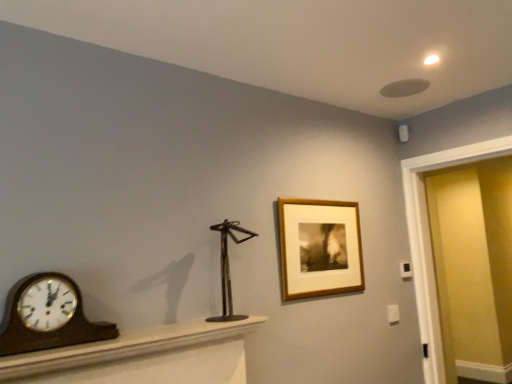
Question: Would you consider metallic sculpture at center to be distant from wooden polished clock at left?

Choices:
 (A) no
 (B) yes

Answer: (A)

Question: Is metallic sculpture at center next to wooden polished clock at left and touching it?

Choices:
 (A) no
 (B) yes

Answer: (A)

Question: Is metallic sculpture at center behind wooden polished clock at left?

Choices:
 (A) no
 (B) yes

Answer: (B)

Question: Is metallic sculpture at center located outside wooden polished clock at left?

Choices:
 (A) yes
 (B) no

Answer: (A)

Question: From the image's perspective, is metallic sculpture at center under wooden polished clock at left?

Choices:
 (A) no
 (B) yes

Answer: (A)

Question: Is matte yellow door at right spatially inside wooden polished clock at left, or outside of it?

Choices:
 (A) outside
 (B) inside

Answer: (A)

Question: Based on their positions, is matte yellow door at right located to the left or right of wooden polished clock at left?

Choices:
 (A) right
 (B) left

Answer: (A)

Question: Based on their sizes in the image, would you say matte yellow door at right is bigger or smaller than wooden polished clock at left?

Choices:
 (A) small
 (B) big

Answer: (B)

Question: In terms of width, does matte yellow door at right look wider or thinner when compared to wooden polished clock at left?

Choices:
 (A) thin
 (B) wide

Answer: (B)

Question: Considering the positions of matte yellow door at right and brown wood mantel at lower left in the image, is matte yellow door at right wider or thinner than brown wood mantel at lower left?

Choices:
 (A) wide
 (B) thin

Answer: (B)

Question: Is point (457, 301) closer or farther from the camera than point (222, 375)?

Choices:
 (A) closer
 (B) farther

Answer: (B)

Question: Relative to brown wood mantel at lower left, is matte yellow door at right in front or behind?

Choices:
 (A) behind
 (B) front

Answer: (A)

Question: From a real-world perspective, is matte yellow door at right physically located above or below brown wood mantel at lower left?

Choices:
 (A) above
 (B) below

Answer: (A)

Question: From the image's perspective, is wooden frame at upper right positioned above or below wooden polished clock at left?

Choices:
 (A) below
 (B) above

Answer: (B)

Question: Which is correct: wooden frame at upper right is inside wooden polished clock at left, or outside of it?

Choices:
 (A) inside
 (B) outside

Answer: (B)